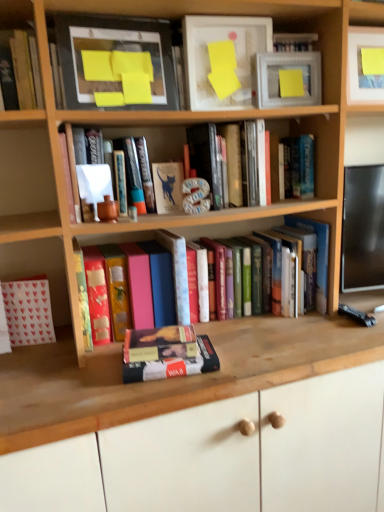
Identify the location of vacant area on top of hardcover book at center, which is the 4th book in left-to-right order (from a real-world perspective). (163, 338).